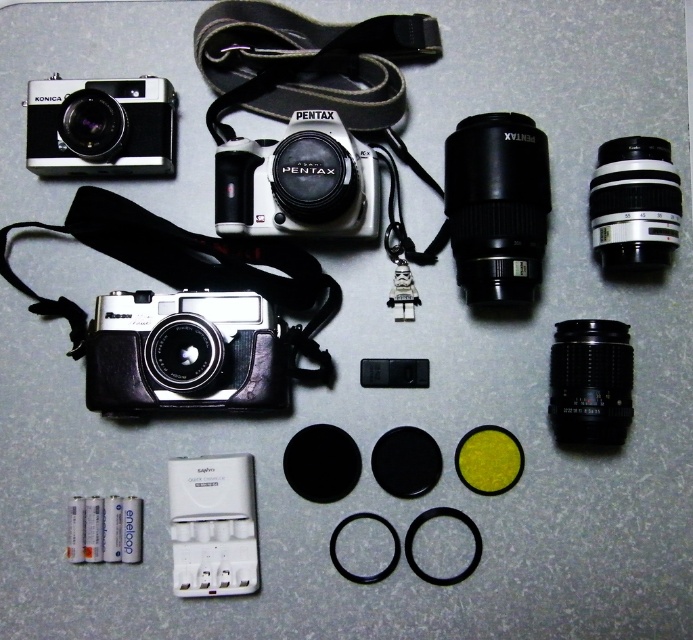
From the picture: Is black plastic lens at upper center positioned before matte black camera at upper left?

Yes, it is.

Is black plastic lens at upper center shorter than matte black camera at upper left?

In fact, black plastic lens at upper center may be taller than matte black camera at upper left.

Find the location of a particular element. The image size is (693, 640). black plastic lens at upper center is located at coordinates (498, 205).

Which is below, black plastic lens at upper center or black plastic lens at upper right?

black plastic lens at upper center is below.

Between point (493, 234) and point (642, 212), which one is positioned in front?

Point (642, 212)

Who is more distant from viewer, (x=473, y=275) or (x=602, y=216)?

Positioned behind is point (x=473, y=275).

Locate an element on the screen. The height and width of the screenshot is (640, 693). black plastic lens at upper center is located at coordinates (498, 205).

Find the location of a particular element. This screenshot has width=693, height=640. black leather strap at upper center is located at coordinates (307, 64).

Is black leather strap at upper center closer to camera compared to black plastic lens at lower right?

No, it is behind black plastic lens at lower right.

Describe the element at coordinates (307, 64) in the screenshot. The image size is (693, 640). I see `black leather strap at upper center` at that location.

Identify the location of black leather strap at upper center. (307, 64).